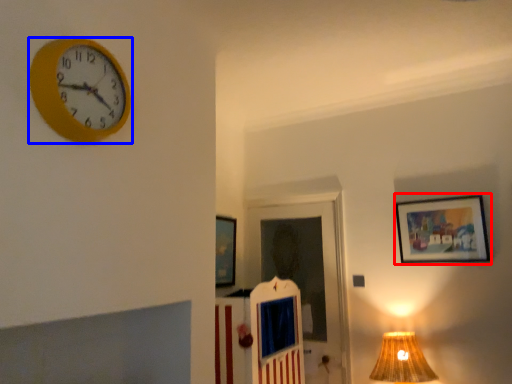
Question: Which object is further to the camera taking this photo, picture frame (highlighted by a red box) or wall clock (highlighted by a blue box)?

Choices:
 (A) picture frame
 (B) wall clock

Answer: (A)